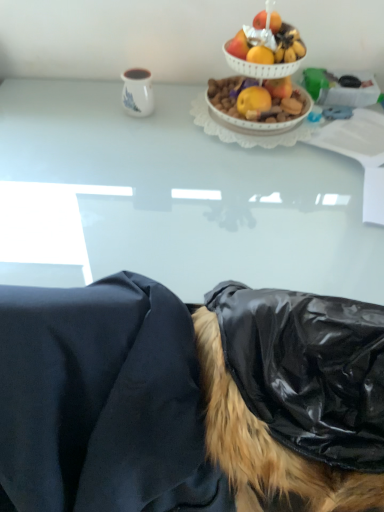
Where is `free spot in front of white ceramic mug at upper center`? This screenshot has width=384, height=512. free spot in front of white ceramic mug at upper center is located at coordinates (134, 140).